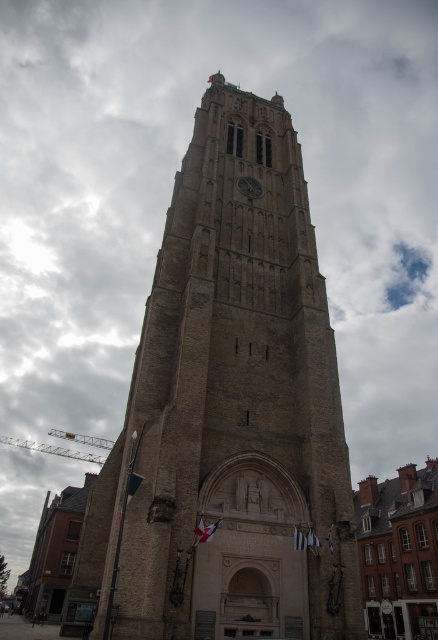
Question: Observing the image, what is the correct spatial positioning of brown stone tower at center in reference to dark gray stone clock at center?

Choices:
 (A) right
 (B) left

Answer: (B)

Question: Can you confirm if brown stone tower at center is positioned above dark gray stone clock at center?

Choices:
 (A) yes
 (B) no

Answer: (B)

Question: Which point appears farthest from the camera in this image?

Choices:
 (A) (260, 481)
 (B) (247, 184)

Answer: (B)

Question: Which of the following is the farthest from the observer?

Choices:
 (A) (229, 323)
 (B) (236, 182)

Answer: (B)

Question: Observing the image, what is the correct spatial positioning of brown stone tower at center in reference to dark gray stone clock at center?

Choices:
 (A) left
 (B) right

Answer: (A)

Question: Which of the following is the closest to the observer?

Choices:
 (A) brown stone tower at center
 (B) dark gray stone clock at center

Answer: (A)